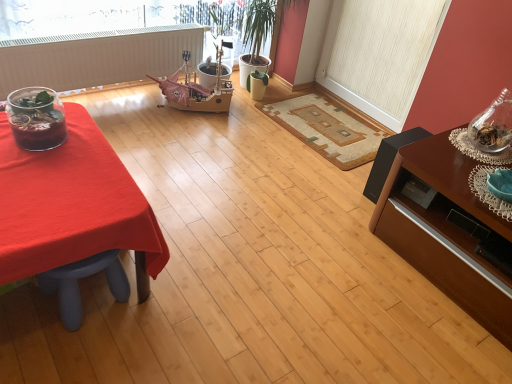
This screenshot has width=512, height=384. In order to click on free location to the left of clear glass jar at right in this screenshot , I will do `click(440, 148)`.